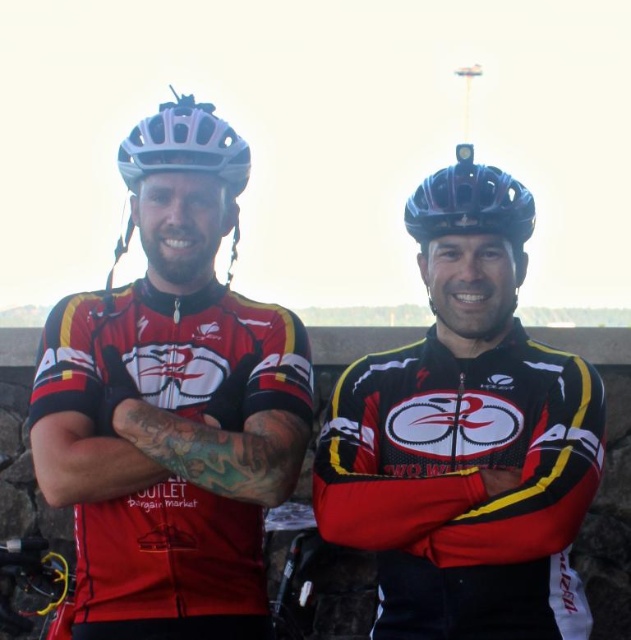
You are a photographer setting up for a portrait shoot. You need to ensure that the matte black cycling jersey at center and the black matte helmet at center are both clearly visible in the frame. Given their sizes, which object should you focus on first to ensure proper framing?

The matte black cycling jersey at center has a larger size compared to the black matte helmet at center, so you should focus on the matte black cycling jersey at center first to ensure proper framing as it occupies more space in the frame.

You are a photographer trying to capture both the black matte helmet at center and the white matte bicycle helmet at upper left in a single shot. Based on their positions, which helmet will appear closer to the camera in the photo?

The black matte helmet at center will appear closer to the camera because the white matte bicycle helmet at upper left is positioned behind it.

You are a photographer setting up a shoot. You need to place a small prop between the black matte helmet at center and the white matte bicycle helmet at upper left. Based on their positions, which helmet should the prop be closer to?

The black matte helmet at center is positioned on the right side of the white matte bicycle helmet at upper left, so the prop should be placed closer to the white matte bicycle helmet at upper left.